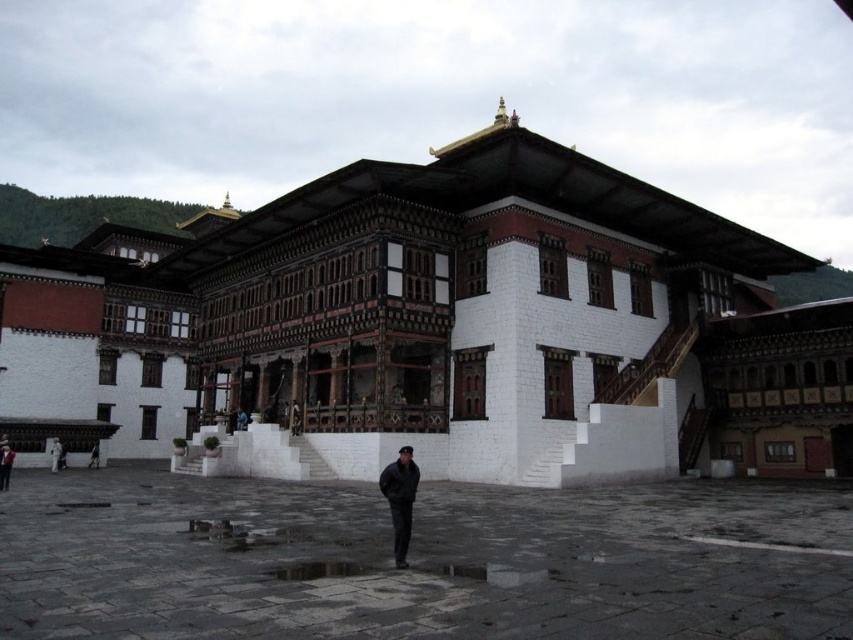
Question: Can you confirm if black matte jacket at center is positioned to the right of black fabric person at center?

Choices:
 (A) yes
 (B) no

Answer: (A)

Question: Estimate the real-world distances between objects in this image. Which object is closer to the dark gray fabric jacket at lower left?

Choices:
 (A) gray stone courtyard at center
 (B) black matte jacket at center
 (C) white painted wood monastery at center

Answer: (A)

Question: Does dark gray fabric at lower left appear over black fabric person at center?

Choices:
 (A) no
 (B) yes

Answer: (B)

Question: Can you confirm if white painted wood monastery at center is positioned to the right of black matte jacket at center?

Choices:
 (A) no
 (B) yes

Answer: (A)

Question: Which of the following is the closest to the observer?

Choices:
 (A) dark gray fabric at lower left
 (B) black matte jacket at center
 (C) dark gray fabric jacket at lower left
 (D) white painted wood monastery at center

Answer: (B)

Question: Which point appears farthest from the camera in this image?

Choices:
 (A) (96, 454)
 (B) (387, 476)

Answer: (A)